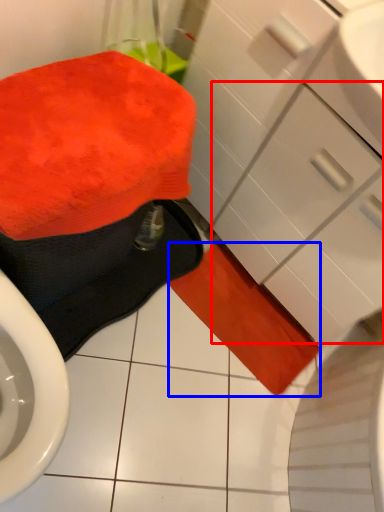
Question: Which of the following is the farthest to the observer, drawer (highlighted by a red box) or bath towel (highlighted by a blue box)?

Choices:
 (A) drawer
 (B) bath towel

Answer: (B)